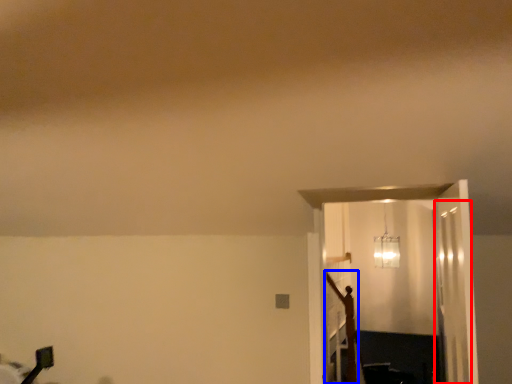
Question: Which object is closer to the camera taking this photo, glass door (highlighted by a red box) or crucifix (highlighted by a blue box)?

Choices:
 (A) glass door
 (B) crucifix

Answer: (A)